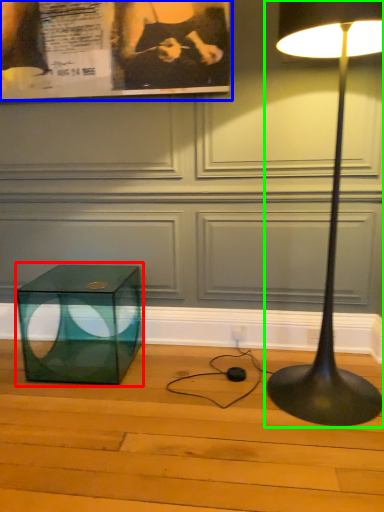
Question: Estimate the real-world distances between objects in this image. Which object is closer to table (highlighted by a red box), poster page (highlighted by a blue box) or lamp (highlighted by a green box)?

Choices:
 (A) poster page
 (B) lamp

Answer: (A)